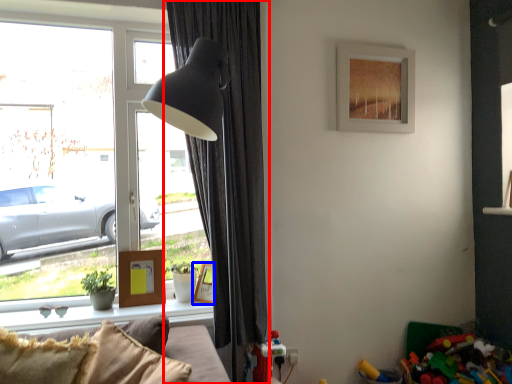
Question: Which point is further to the camera, curtain (highlighted by a red box) or picture frame (highlighted by a blue box)?

Choices:
 (A) curtain
 (B) picture frame

Answer: (B)